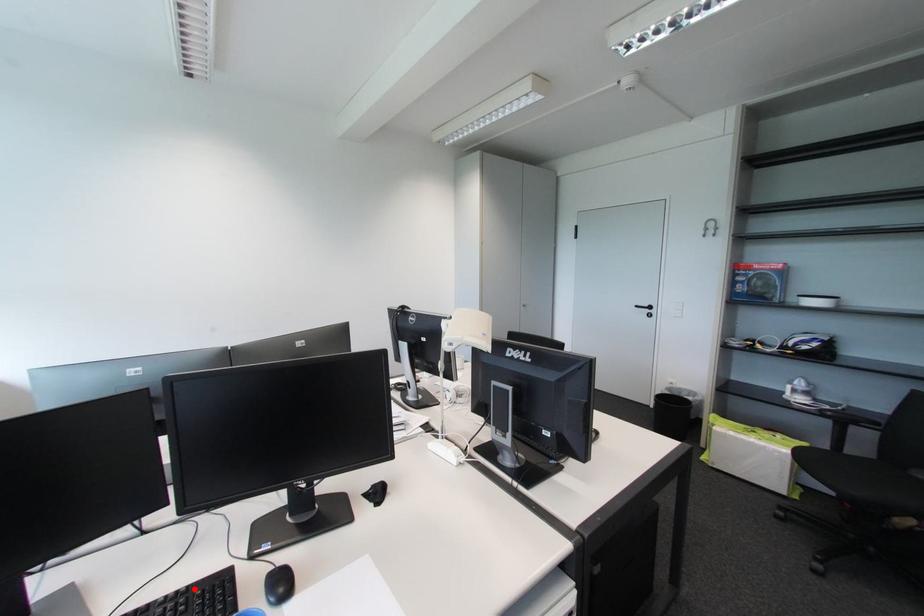
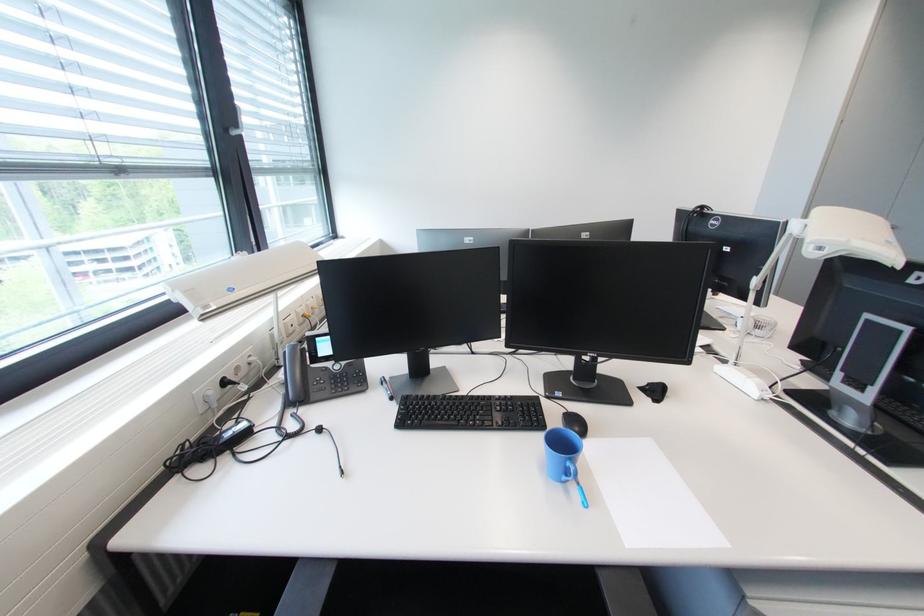
Where in the second image is the point corresponding to the highlighted location from the first image?

(517, 398)